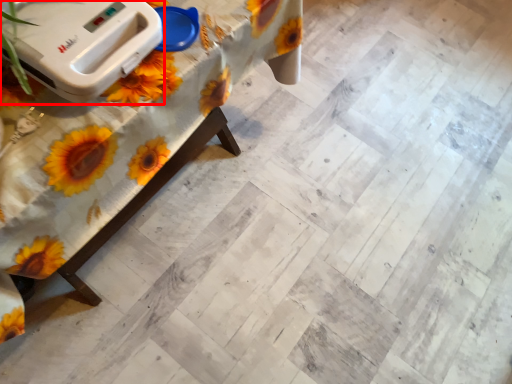
Question: From the image's perspective, where is appliance (annotated by the red box) located relative to table?

Choices:
 (A) above
 (B) below

Answer: (A)